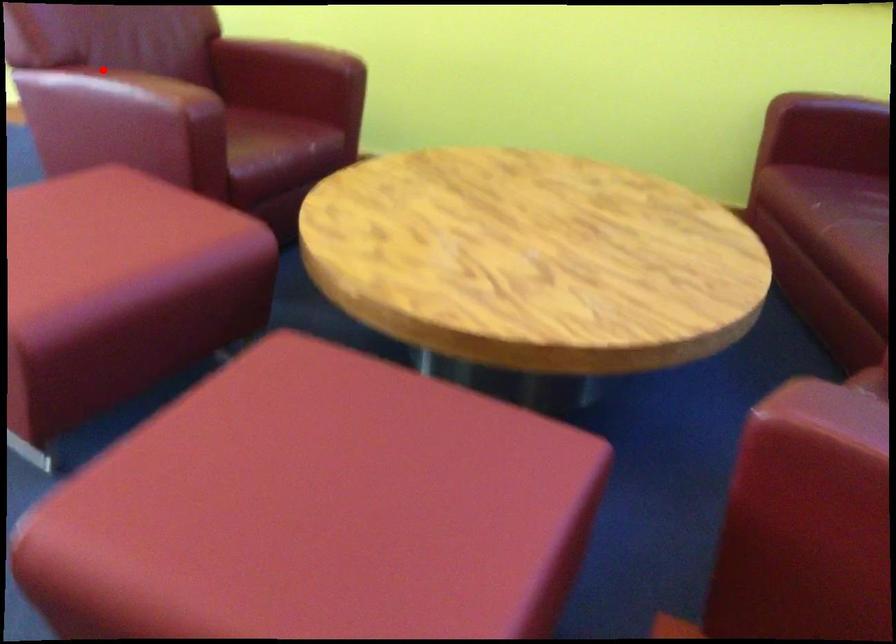
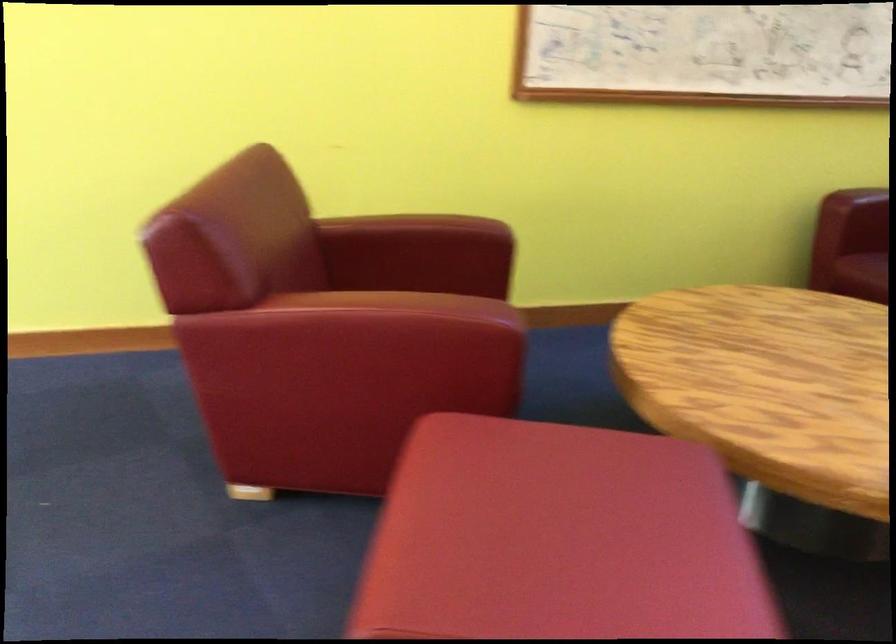
Where in the second image is the point corresponding to the highlighted location from the first image?

(356, 301)